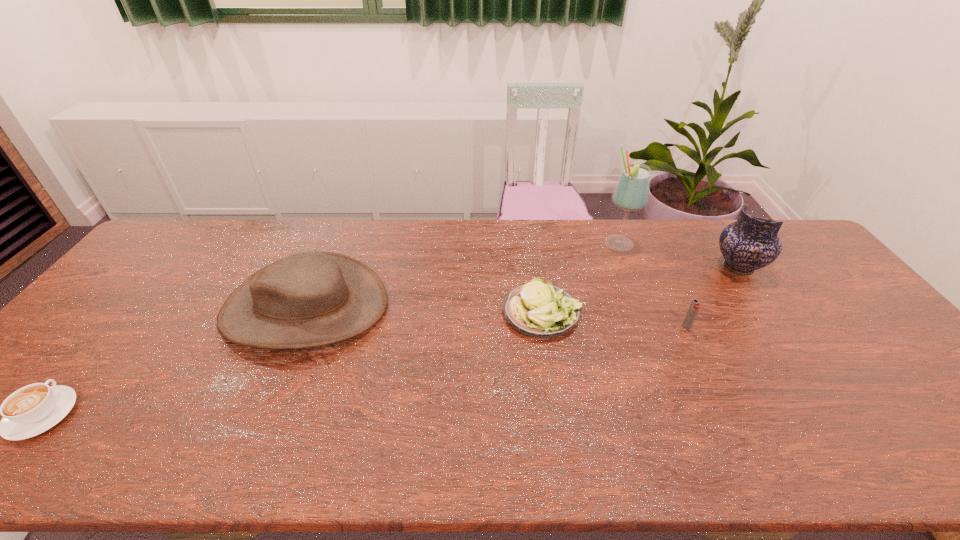
Identify the location of vacant area in the image that satisfies the following two spatial constraints: 1. on the back side of the lettuce; 2. on the right side of the rightmost object. This screenshot has height=540, width=960. (535, 267).

Image resolution: width=960 pixels, height=540 pixels. What are the coordinates of `vacant space that satisfies the following two spatial constraints: 1. on the back side of the cowboy hat; 2. on the left side of the tallest object` in the screenshot? It's located at (332, 244).